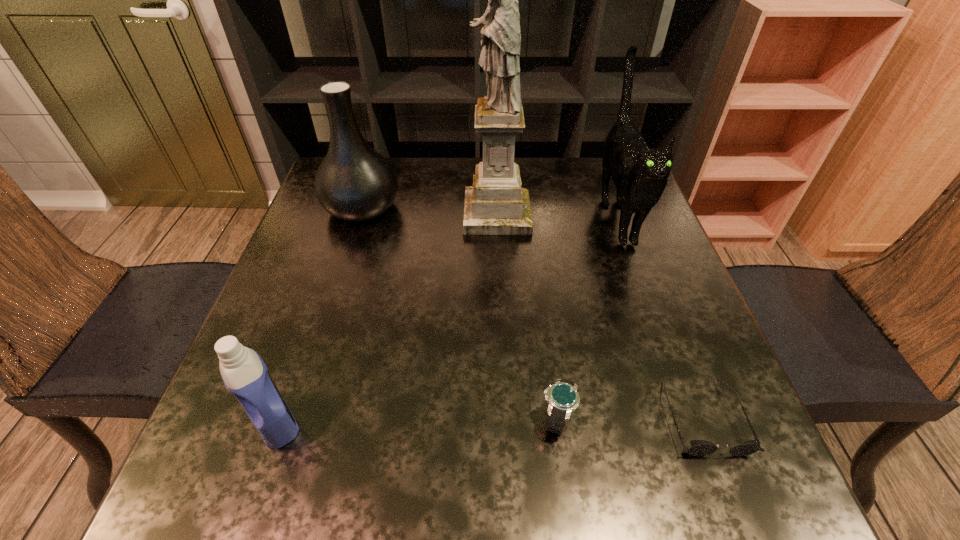
Where is `sculpture`? Image resolution: width=960 pixels, height=540 pixels. sculpture is located at coordinates (496, 204).

Find the location of a particular element. cat is located at coordinates (640, 174).

The width and height of the screenshot is (960, 540). In order to click on vase in this screenshot , I will do `click(354, 182)`.

Where is `detergent`? This screenshot has width=960, height=540. detergent is located at coordinates (244, 373).

You are a GUI agent. You are given a task and a screenshot of the screen. Output one action in this format:
    pyautogui.click(x=<x>, y=<y>)
    Task: Click on the fifth tallest object
    
    Given the screenshot: What is the action you would take?
    pyautogui.click(x=562, y=396)

At what (x,y) coordinates should I click in order to perform the action: click on sunglasses. Please return your answer as a coordinate pair (x, y). The height and width of the screenshot is (540, 960). Looking at the image, I should click on (698, 447).

The width and height of the screenshot is (960, 540). Identify the location of blank space located on the front-facing side of the sculpture. (386, 214).

Where is `free space located 0.160m on the front-facing side of the sculpture`? The width and height of the screenshot is (960, 540). free space located 0.160m on the front-facing side of the sculpture is located at coordinates (401, 214).

You are a GUI agent. You are given a task and a screenshot of the screen. Output one action in this format:
    pyautogui.click(x=<x>, y=<y>)
    Task: Click on the free spot located on the front-facing side of the sculpture
    The height and width of the screenshot is (540, 960).
    Given the screenshot: What is the action you would take?
    pyautogui.click(x=316, y=214)

Where is `vacant space located 0.250m on the face of the cat`? This screenshot has height=540, width=960. vacant space located 0.250m on the face of the cat is located at coordinates (666, 354).